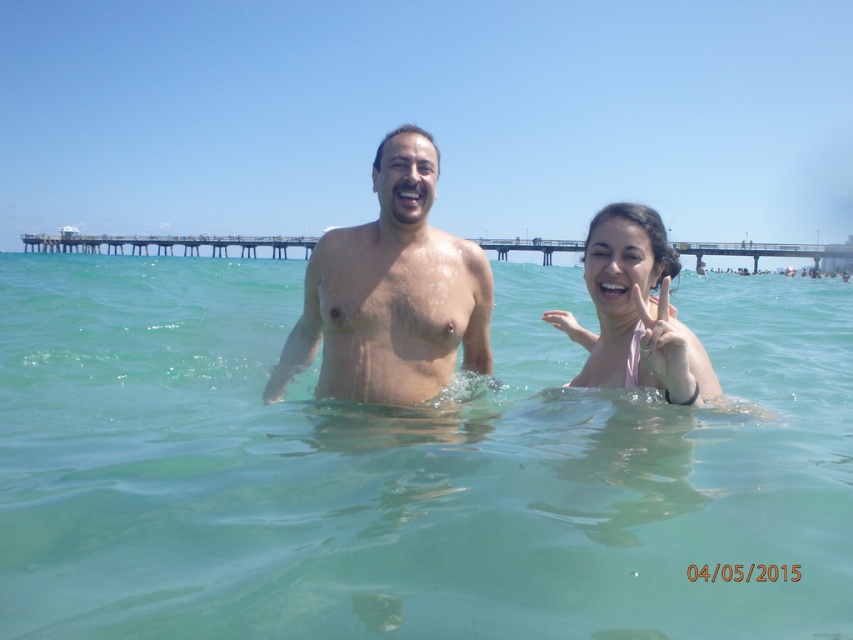
Which is more to the right, clear water at center or smooth skin man at center?

Positioned to the right is smooth skin man at center.

Does clear water at center have a greater width compared to smooth skin man at center?

Yes, clear water at center is wider than smooth skin man at center.

Who is more forward, (850, 442) or (309, 307)?

Point (850, 442)

Identify the location of clear water at center. This screenshot has width=853, height=640. coord(410,468).

Is point (631, 269) more distant than point (672, 248)?

No.

Identify the location of pink fabric at right. (635, 310).

Based on the photo, is smooth skin man at center positioned at the back of wooden pier at upper center?

No, smooth skin man at center is in front of wooden pier at upper center.

Locate an element on the screen. smooth skin man at center is located at coordinates (392, 292).

At what (x,y) coordinates should I click in order to perform the action: click on smooth skin man at center. Please return your answer as a coordinate pair (x, y). Looking at the image, I should click on (392, 292).